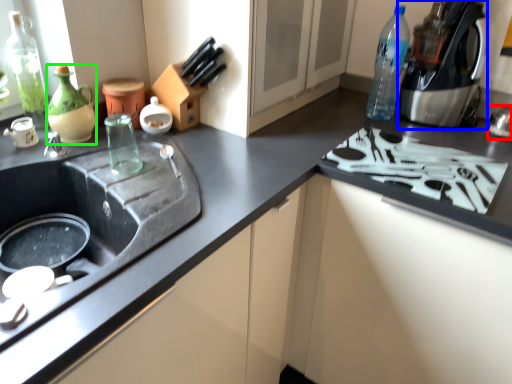
Question: Which object is positioned farthest from appliance (highlighted by a red box)? Select from coffee machine (highlighted by a blue box) and tea pot (highlighted by a green box).

Choices:
 (A) coffee machine
 (B) tea pot

Answer: (B)